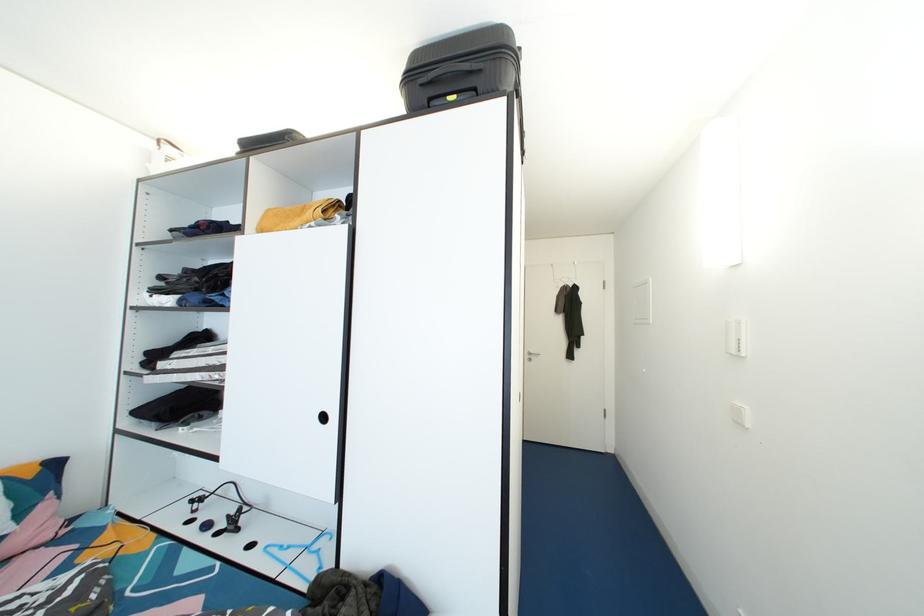
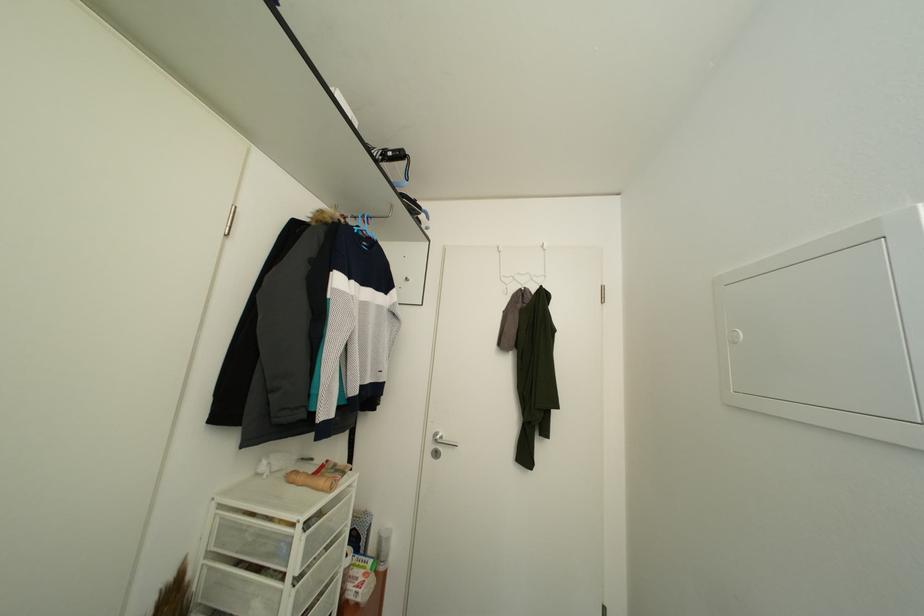
Based on the photo, in a continuous first-person perspective shot, in which direction is the camera moving?

The cameraman walked toward right, forward.